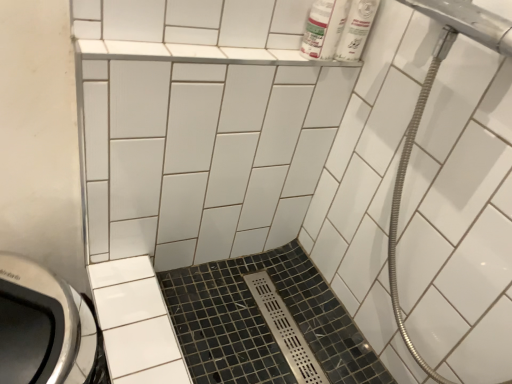
Where is `white plastic bottles at upper right`? Image resolution: width=512 pixels, height=384 pixels. white plastic bottles at upper right is located at coordinates (356, 29).

How much space does white glossy ceramic tile at upper center, marked as the first ceramic tile in a top-to-bottom arrangement, occupy vertically?

white glossy ceramic tile at upper center, marked as the first ceramic tile in a top-to-bottom arrangement, is 22.07 inches tall.

Identify the location of metallic silver showerhead at upper right. This screenshot has width=512, height=384. (461, 220).

From the picture: In order to face metallic silver showerhead at upper right, should I rotate leftwards or rightwards?

To face it directly, rotate right by 19.924 degrees.

The width and height of the screenshot is (512, 384). In order to click on white plastic bottles at upper right in this screenshot , I will do `click(356, 29)`.

Which of these two, metallic silver showerhead at upper right or white plastic bottles at upper right, is thinner?

Thinner between the two is white plastic bottles at upper right.

Would you consider metallic silver showerhead at upper right to be distant from white plastic bottles at upper right?

metallic silver showerhead at upper right is near white plastic bottles at upper right, not far away.

Does point (378, 227) come behind point (368, 14)?

That is True.

How many degrees apart are the facing directions of black mosaic tile at center, marked as the second ceramic tile in a top-to-bottom arrangement, and metallic silver showerhead at upper right?

black mosaic tile at center, marked as the second ceramic tile in a top-to-bottom arrangement, and metallic silver showerhead at upper right are facing 0.8 degrees away from each other.

Is metallic silver showerhead at upper right surrounded by black mosaic tile at center, marked as the second ceramic tile in a top-to-bottom arrangement?

No.

Considering their positions, is black mosaic tile at center, marked as the second ceramic tile in a top-to-bottom arrangement, located in front of or behind metallic silver showerhead at upper right?

Clearly, black mosaic tile at center, marked as the second ceramic tile in a top-to-bottom arrangement, is behind metallic silver showerhead at upper right.

From a real-world perspective, who is located higher, black mosaic tile at center, arranged as the 1th ceramic tile when ordered from the bottom, or metallic silver showerhead at upper right?

metallic silver showerhead at upper right is physically above.

Is white glossy ceramic tile at upper center, which is the second ceramic tile from bottom to top, to the left of white plastic bottles at upper right from the viewer's perspective?

Yes, white glossy ceramic tile at upper center, which is the second ceramic tile from bottom to top, is to the left of white plastic bottles at upper right.

Is white glossy ceramic tile at upper center, which is the second ceramic tile from bottom to top, closer to camera compared to white plastic bottles at upper right?

Yes, the depth of white glossy ceramic tile at upper center, which is the second ceramic tile from bottom to top, is less than that of white plastic bottles at upper right.

Do you think white glossy ceramic tile at upper center, which is the second ceramic tile from bottom to top, is within white plastic bottles at upper right, or outside of it?

white glossy ceramic tile at upper center, which is the second ceramic tile from bottom to top, is located beyond the bounds of white plastic bottles at upper right.

Does white glossy ceramic tile at upper center, which is the second ceramic tile from bottom to top, turn towards metallic silver showerhead at upper right?

Yes.

What's the angular difference between white glossy ceramic tile at upper center, marked as the first ceramic tile in a top-to-bottom arrangement, and metallic silver showerhead at upper right's facing directions?

87.4 degrees.

What are the coordinates of `the 1st ceramic tile behind the metallic silver showerhead at upper right, starting your count from the anchor` in the screenshot? It's located at (205, 156).

Is metallic silver showerhead at upper right surrounded by white glossy ceramic tile at upper center, marked as the first ceramic tile in a top-to-bottom arrangement?

Actually, metallic silver showerhead at upper right is outside white glossy ceramic tile at upper center, marked as the first ceramic tile in a top-to-bottom arrangement.

Visually, is white plastic bottles at upper right positioned to the left or to the right of white glossy ceramic tile at upper center, marked as the first ceramic tile in a top-to-bottom arrangement?

From the image, it's evident that white plastic bottles at upper right is to the right of white glossy ceramic tile at upper center, marked as the first ceramic tile in a top-to-bottom arrangement.

Where is `toiletry above the white glossy ceramic tile at upper center, which is the second ceramic tile from bottom to top (from a real-world perspective)`? This screenshot has width=512, height=384. toiletry above the white glossy ceramic tile at upper center, which is the second ceramic tile from bottom to top (from a real-world perspective) is located at coordinates (356, 29).

Which of these two, white plastic bottles at upper right or white glossy ceramic tile at upper center, which is the second ceramic tile from bottom to top, stands shorter?

Standing shorter between the two is white plastic bottles at upper right.

Is white plastic bottles at upper right thinner than white glossy ceramic tile at upper center, marked as the first ceramic tile in a top-to-bottom arrangement?

Yes.

From the picture: From the image's perspective, is white glossy ceramic tile at upper center, which is the second ceramic tile from bottom to top, positioned above or below black mosaic tile at center, arranged as the 1th ceramic tile when ordered from the bottom?

white glossy ceramic tile at upper center, which is the second ceramic tile from bottom to top, is situated higher than black mosaic tile at center, arranged as the 1th ceramic tile when ordered from the bottom, in the image.

Is white glossy ceramic tile at upper center, which is the second ceramic tile from bottom to top, smaller than black mosaic tile at center, marked as the second ceramic tile in a top-to-bottom arrangement?

Incorrect, white glossy ceramic tile at upper center, which is the second ceramic tile from bottom to top, is not smaller in size than black mosaic tile at center, marked as the second ceramic tile in a top-to-bottom arrangement.

Is white glossy ceramic tile at upper center, marked as the first ceramic tile in a top-to-bottom arrangement, at the left side of black mosaic tile at center, arranged as the 1th ceramic tile when ordered from the bottom?

Correct, you'll find white glossy ceramic tile at upper center, marked as the first ceramic tile in a top-to-bottom arrangement, to the left of black mosaic tile at center, arranged as the 1th ceramic tile when ordered from the bottom.

How many degrees apart are the facing directions of white glossy ceramic tile at upper center, marked as the first ceramic tile in a top-to-bottom arrangement, and black mosaic tile at center, arranged as the 1th ceramic tile when ordered from the bottom?

88.2 degrees.

Looking at this image, is black mosaic tile at center, arranged as the 1th ceramic tile when ordered from the bottom, next to white glossy ceramic tile at upper center, which is the second ceramic tile from bottom to top?

No.

I want to click on ceramic tile that is on the right side of white glossy ceramic tile at upper center, which is the second ceramic tile from bottom to top, so click(263, 322).

In terms of height, does black mosaic tile at center, arranged as the 1th ceramic tile when ordered from the bottom, look taller or shorter compared to white glossy ceramic tile at upper center, which is the second ceramic tile from bottom to top?

black mosaic tile at center, arranged as the 1th ceramic tile when ordered from the bottom, is shorter than white glossy ceramic tile at upper center, which is the second ceramic tile from bottom to top.

Does black mosaic tile at center, marked as the second ceramic tile in a top-to-bottom arrangement, contain white glossy ceramic tile at upper center, which is the second ceramic tile from bottom to top?

Definitely not — white glossy ceramic tile at upper center, which is the second ceramic tile from bottom to top, is not inside black mosaic tile at center, marked as the second ceramic tile in a top-to-bottom arrangement.

At what (x,y) coordinates should I click in order to perform the action: click on toiletry above the metallic silver showerhead at upper right (from a real-world perspective). Please return your answer as a coordinate pair (x, y). Looking at the image, I should click on (356, 29).

Starting from the metallic silver showerhead at upper right, which ceramic tile is the 2nd one behind? Please provide its 2D coordinates.

[(263, 322)]

Considering their positions, is black mosaic tile at center, marked as the second ceramic tile in a top-to-bottom arrangement, positioned closer to white glossy ceramic tile at upper center, which is the second ceramic tile from bottom to top, than metallic silver showerhead at upper right?

black mosaic tile at center, marked as the second ceramic tile in a top-to-bottom arrangement, is positioned closer to the anchor white glossy ceramic tile at upper center, which is the second ceramic tile from bottom to top.

When comparing their distances from white plastic bottles at upper right, does black mosaic tile at center, arranged as the 1th ceramic tile when ordered from the bottom, or metallic silver showerhead at upper right seem further?

Among the two, black mosaic tile at center, arranged as the 1th ceramic tile when ordered from the bottom, is located further to white plastic bottles at upper right.

Based on the photo, considering their positions, is white glossy ceramic tile at upper center, which is the second ceramic tile from bottom to top, positioned closer to white plastic bottles at upper right than black mosaic tile at center, marked as the second ceramic tile in a top-to-bottom arrangement?

white glossy ceramic tile at upper center, which is the second ceramic tile from bottom to top.

Estimate the real-world distances between objects in this image. Which object is further from black mosaic tile at center, arranged as the 1th ceramic tile when ordered from the bottom, metallic silver showerhead at upper right or white plastic bottles at upper right?

Among the two, white plastic bottles at upper right is located further to black mosaic tile at center, arranged as the 1th ceramic tile when ordered from the bottom.

Considering their positions, is white glossy ceramic tile at upper center, which is the second ceramic tile from bottom to top, positioned further to black mosaic tile at center, arranged as the 1th ceramic tile when ordered from the bottom, than metallic silver showerhead at upper right?

metallic silver showerhead at upper right lies further to black mosaic tile at center, arranged as the 1th ceramic tile when ordered from the bottom, than the other object.

Looking at the image, which one is located further to black mosaic tile at center, arranged as the 1th ceramic tile when ordered from the bottom, white glossy ceramic tile at upper center, marked as the first ceramic tile in a top-to-bottom arrangement, or white plastic bottles at upper right?

white plastic bottles at upper right.

Based on their spatial positions, is metallic silver showerhead at upper right or black mosaic tile at center, marked as the second ceramic tile in a top-to-bottom arrangement, closer to white plastic bottles at upper right?

metallic silver showerhead at upper right.

From the image, which object appears to be farther from black mosaic tile at center, marked as the second ceramic tile in a top-to-bottom arrangement, white plastic bottles at upper right or white glossy ceramic tile at upper center, which is the second ceramic tile from bottom to top?

The object further to black mosaic tile at center, marked as the second ceramic tile in a top-to-bottom arrangement, is white plastic bottles at upper right.

Image resolution: width=512 pixels, height=384 pixels. What are the coordinates of `ceramic tile between metallic silver showerhead at upper right and black mosaic tile at center, marked as the second ceramic tile in a top-to-bottom arrangement, along the z-axis` in the screenshot? It's located at (x=205, y=156).

This screenshot has width=512, height=384. I want to click on ceramic tile between metallic silver showerhead at upper right and white plastic bottles at upper right from front to back, so 205,156.

You are a GUI agent. You are given a task and a screenshot of the screen. Output one action in this format:
    pyautogui.click(x=<x>, y=<y>)
    Task: Click on the bath between white plastic bottles at upper right and black mosaic tile at center, marked as the second ceramic tile in a top-to-bottom arrangement, from top to bottom
    The height and width of the screenshot is (384, 512).
    Given the screenshot: What is the action you would take?
    pyautogui.click(x=461, y=220)

Where is `ceramic tile that lies between white plastic bottles at upper right and black mosaic tile at center, marked as the second ceramic tile in a top-to-bottom arrangement, from top to bottom`? The width and height of the screenshot is (512, 384). ceramic tile that lies between white plastic bottles at upper right and black mosaic tile at center, marked as the second ceramic tile in a top-to-bottom arrangement, from top to bottom is located at coordinates (205, 156).